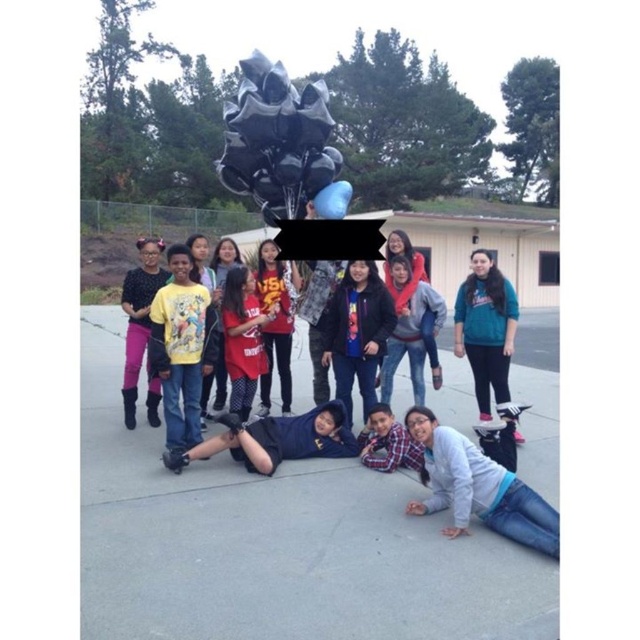
You are a photographer trying to capture a closeup of the black matte hoodie at center without including the teal fleece jacket at lower right in the frame. Based on their positions, is this possible?

The teal fleece jacket at lower right is located above the black matte hoodie at center, so adjusting the camera angle downward might allow you to focus on the black matte hoodie at center while excluding the teal fleece jacket at lower right from the shot.

You are a photographer trying to capture a closeup of the teal fleece jacket at lower right. Based on the coordinates provided, where should you focus your camera lens to ensure the jacket is in the center of your shot?

The teal fleece jacket at lower right is located at coordinates point [484,328], so you should focus your camera lens at that point to center it.

You are a photographer trying to capture the children holding balloons in the image. You notice a point marked at coordinates (484,328) in the lower right area. What object is located at that point?

The point at coordinates (484,328) marks the teal fleece jacket at lower right.